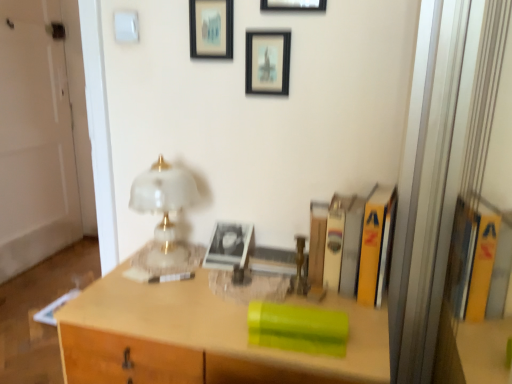
Where is `vacant region in front of hardcover book at center, the 2th book in the right-to-left sequence`? The height and width of the screenshot is (384, 512). vacant region in front of hardcover book at center, the 2th book in the right-to-left sequence is located at coordinates (346, 310).